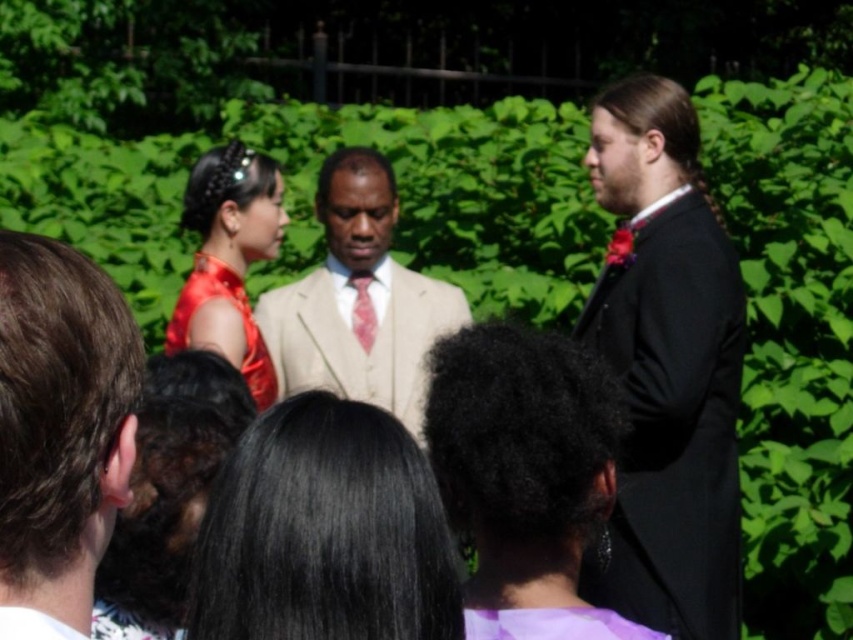
You are a photographer at a wedding and need to adjust the lighting so both the black satin suit at right and beige fabric suit at center are equally illuminated. Considering their heights, which suit should you focus the light on more?

The black satin suit at right is much taller than the beige fabric suit at center, so you should focus the light more on the beige fabric suit at center to ensure it receives adequate illumination given its shorter stature.

You are a photographer at a wedding and need to adjust the lighting to ensure both the brown hair at left and the pink satin tie at center are well lit. Based on their positions, which object should you focus on first to ensure proper exposure?

The brown hair at left is positioned under the pink satin tie at center, so focusing on the pink satin tie at center first would help balance the lighting since it is above and might receive more direct light, ensuring both areas are properly exposed.